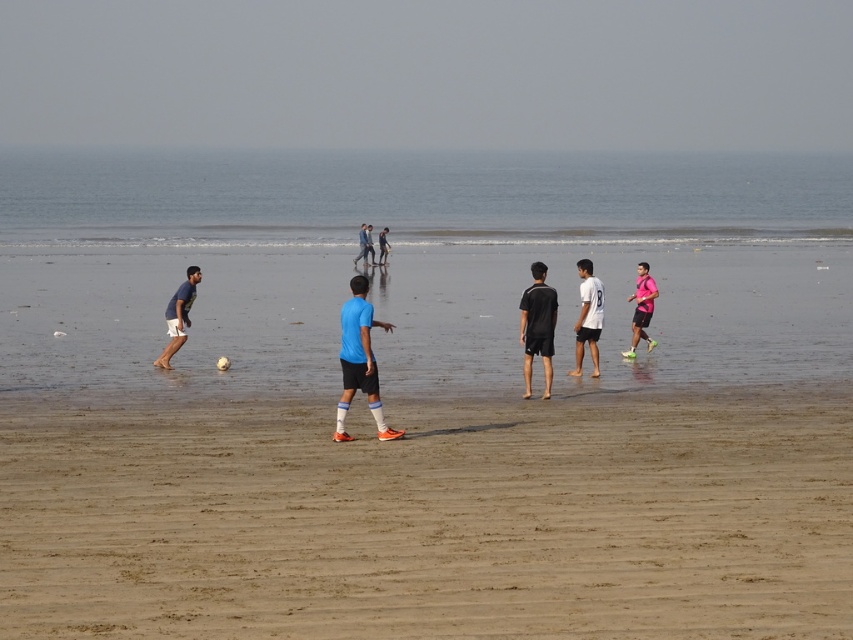
You are a soccer player positioned at the point with coordinates point (585,294). You see another player at point (364,323). In which direction should you move to get closer to the other player?

To get closer to the other player at point (364,323), you should move forward because point (364,323) is in front of point (585,294).

You are a photographer standing at the beach scene. You want to capture a closeup shot of the blue matte soccer ball at center. Considering the distance between you and the ball, can you estimate if you need to move closer or stay where you are?

The blue matte soccer ball at center is 15.26 meters away from the camera. To capture a closeup shot, you would need to move closer to the ball since it is currently 15.26 meters away, which is too far for a closeup.

You are a photographer standing at the edge of the beach, looking towards the soccer game. You want to capture a photo that includes both the blue matte soccer ball at center and the pink matte shirt at right. Based on their positions, will the ball appear above or below the shirt in the photo?

The blue matte soccer ball at center is located below the pink matte shirt at right, so in the photo, the ball will appear below the shirt.